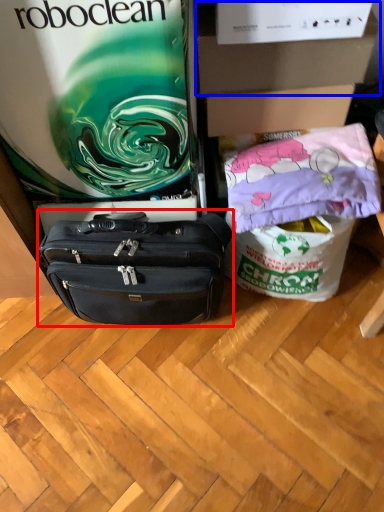
Question: Which object appears farthest to the camera in this image, luggage and bags (highlighted by a red box) or box (highlighted by a blue box)?

Choices:
 (A) luggage and bags
 (B) box

Answer: (B)